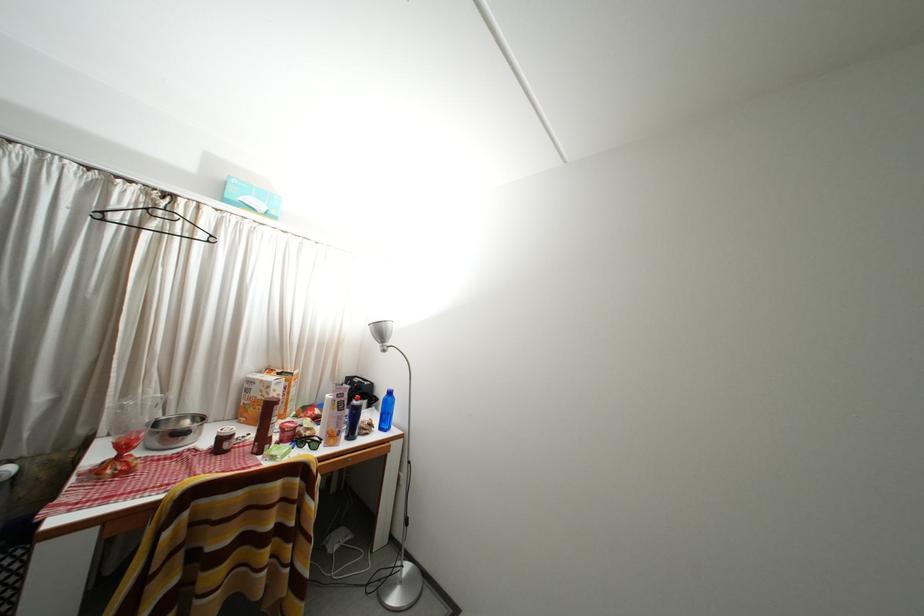
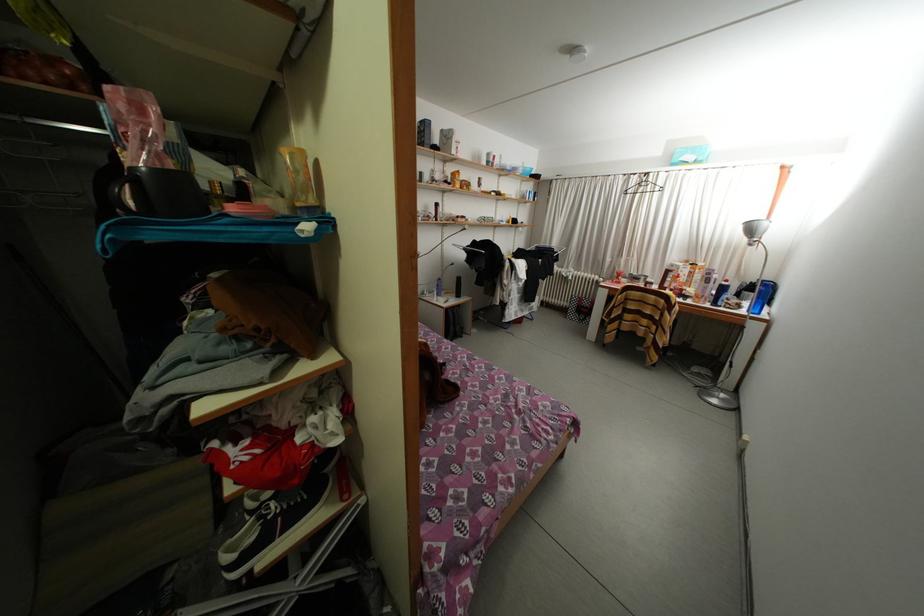
Find the pixel in the second image that matches point (117, 188) in the first image.

(638, 184)